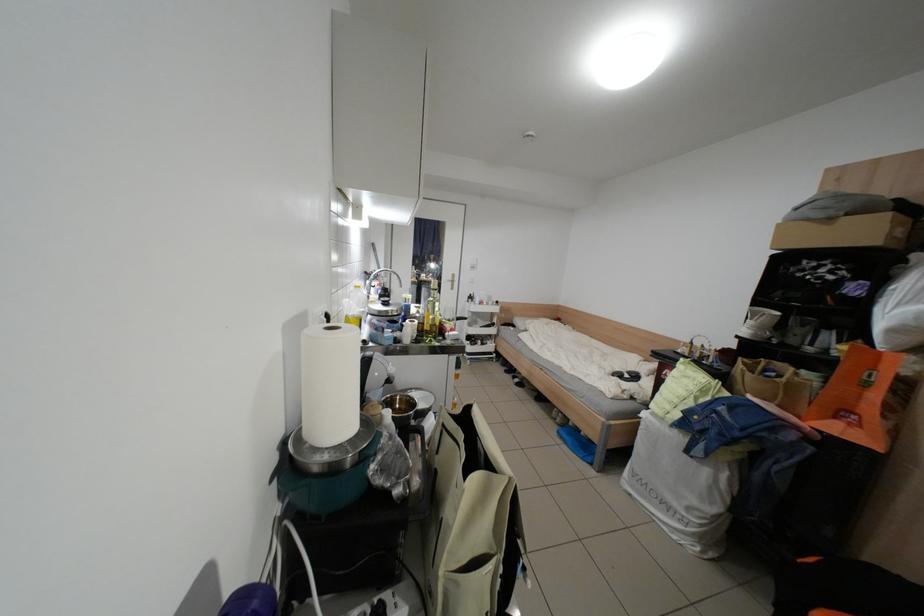
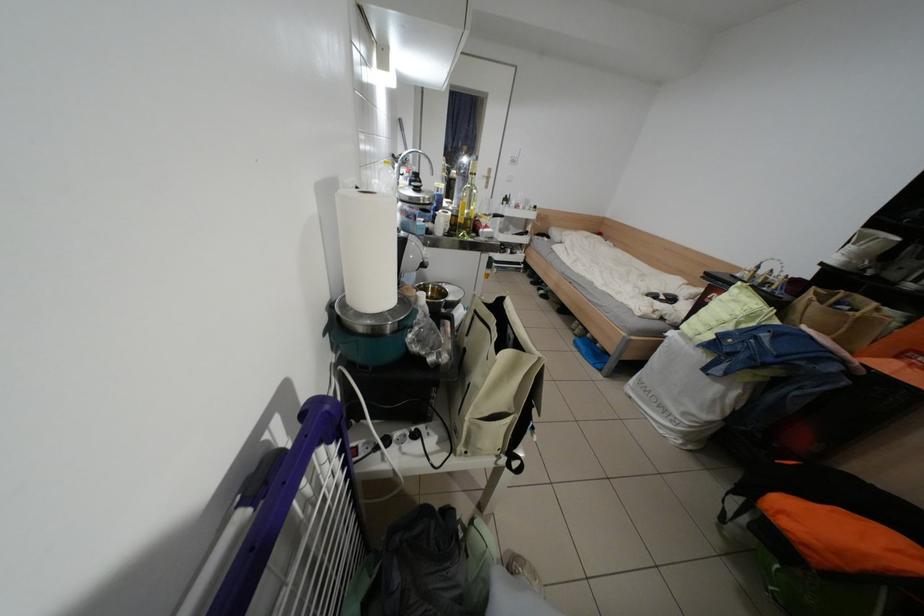
In a continuous first-person perspective shot, in which direction is the camera moving?

The cameraman walked toward left, forward.